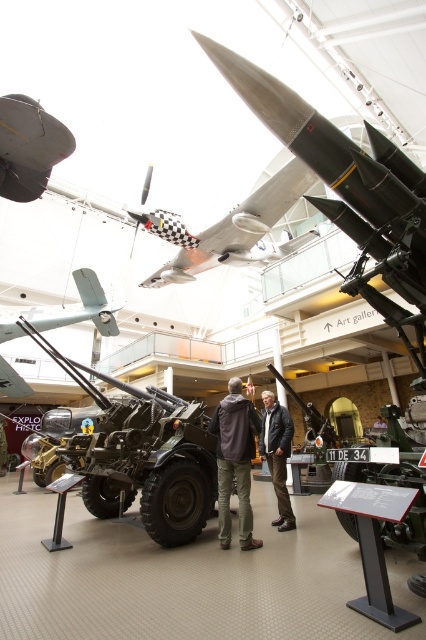
You are a visitor standing in the museum and want to take a photo of both the matte black missile at upper center and the matte gray propeller at center. Which object should you position to the right side in your camera frame?

The matte black missile at upper center should be positioned to the right side in your camera frame because it is located on the right side of the matte gray propeller at center.

You are a museum security guard who needs to move from the matte black artillery gun at center to the light brown leather jacket at center. Can you walk directly between them without any obstacles?

The matte black artillery gun at center and light brown leather jacket at center are 23.02 feet apart, so yes, you can walk directly between them without any obstacles since the distance is sufficient for movement.

In the scene shown: You are a museum visitor standing in the middle of the exhibit. You notice the matte gray propeller at center and the matte black artillery gun at center. Which object appears taller from your current vantage point?

The matte gray propeller at center appears taller than the matte black artillery gun at center from your current vantage point.